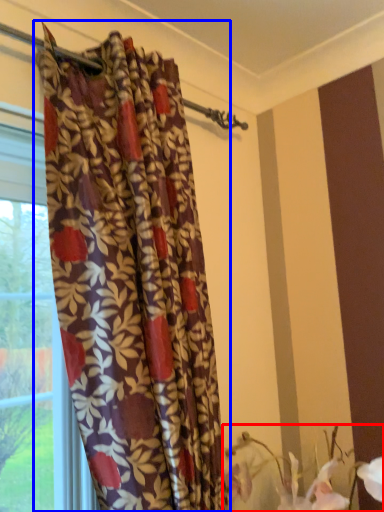
Question: Among these objects, which one is nearest to the camera, floral arrangement (highlighted by a red box) or curtain (highlighted by a blue box)?

Choices:
 (A) floral arrangement
 (B) curtain

Answer: (B)